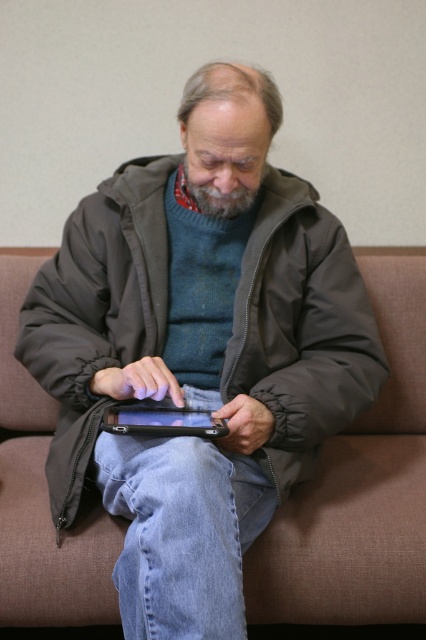
Can you confirm if black glossy tablet at center is positioned to the left of gray/soft hair at center?

Yes, black glossy tablet at center is to the left of gray/soft hair at center.

Which is below, black glossy tablet at center or gray/soft hair at center?

Positioned lower is black glossy tablet at center.

Locate an element on the screen. Image resolution: width=426 pixels, height=640 pixels. black glossy tablet at center is located at coordinates (161, 420).

The image size is (426, 640). I want to click on black glossy tablet at center, so click(161, 420).